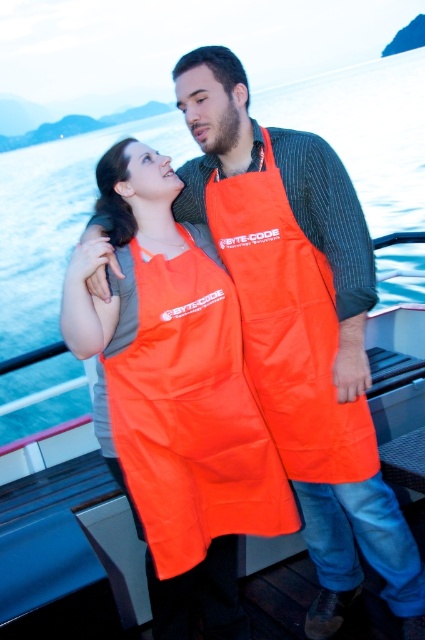
Can you confirm if orange matte apron at center is smaller than orange fabric apron at center?

No.

Who is positioned more to the right, orange matte apron at center or orange fabric apron at center?

From the viewer's perspective, orange fabric apron at center appears more on the right side.

Does point (170, 408) come in front of point (277, 326)?

Yes, point (170, 408) is closer to viewer.

The height and width of the screenshot is (640, 425). What are the coordinates of `orange matte apron at center` in the screenshot? It's located at [187, 412].